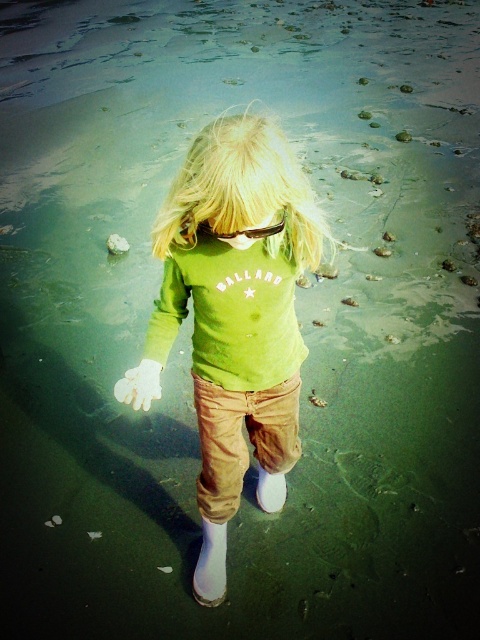
Is point (252, 115) behind point (220, 388)?

Yes, point (252, 115) is farther from viewer.

Who is more forward, [183,225] or [283,451]?

Point [183,225] is more forward.

Image resolution: width=480 pixels, height=640 pixels. I want to click on blonde hair at center, so point(242,193).

You are a GUI agent. You are given a task and a screenshot of the screen. Output one action in this format:
    pyautogui.click(x=<x>, y=<y>)
    Task: Click on the blonde hair at center
    The image size is (480, 640).
    Given the screenshot: What is the action you would take?
    pyautogui.click(x=242, y=193)

Is blonde hair at center positioned behind black plastic goggles at center?

No, it is not.

Identify the location of blonde hair at center. The image size is (480, 640). (242, 193).

Is point (257, 141) farther from camera compared to point (248, 228)?

No.

You are a GUI agent. You are given a task and a screenshot of the screen. Output one action in this format:
    pyautogui.click(x=<x>, y=<y>)
    Task: Click on the blonde hair at center
    The width and height of the screenshot is (480, 640).
    Given the screenshot: What is the action you would take?
    pyautogui.click(x=242, y=193)

Which is behind, point (152, 356) or point (235, 472)?

Positioned behind is point (235, 472).

The width and height of the screenshot is (480, 640). What do you see at coordinates (233, 317) in the screenshot?
I see `green matte shirt at center` at bounding box center [233, 317].

Who is more distant from viewer, (180, 289) or (217, 426)?

The point (217, 426) is more distant.

Identify the location of green matte shirt at center. Image resolution: width=480 pixels, height=640 pixels. (233, 317).